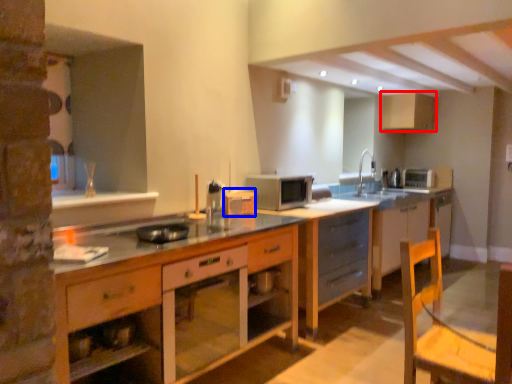
Question: Which point is closer to the camera, cabinetry (highlighted by a red box) or appliance (highlighted by a blue box)?

Choices:
 (A) cabinetry
 (B) appliance

Answer: (B)